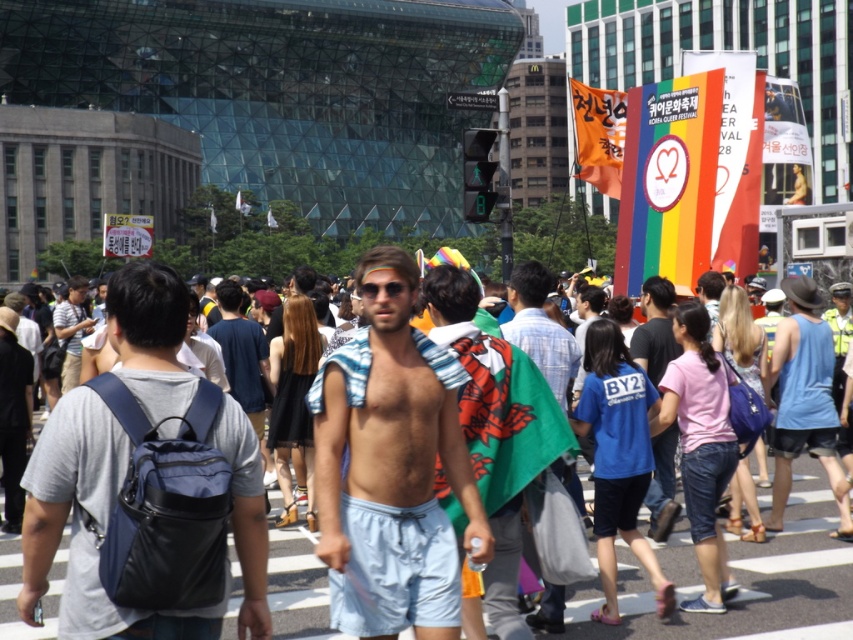
You are a photographer trying to capture a photo of the matte black shirt at left without the green fabric flag at center blocking it. What should you do?

A: The green fabric flag at center is shorter than the matte black shirt at left, so you can lower your camera angle to avoid the flag blocking the view of the matte black shirt at left.

You are a photographer positioned at the street level trying to capture both the green fabric flag at center and the matte black shirt at left in your shot. Which object is positioned closer to your camera lens?

The green fabric flag at center is closer to the viewer than the matte black shirt at left, so it will appear closer to the camera lens.